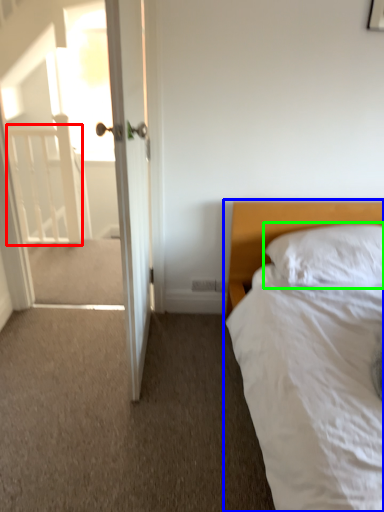
Question: Based on their relative distances, which object is farther from balustrade (highlighted by a red box)? Choose from bed (highlighted by a blue box) and pillow (highlighted by a green box).

Choices:
 (A) bed
 (B) pillow

Answer: (B)